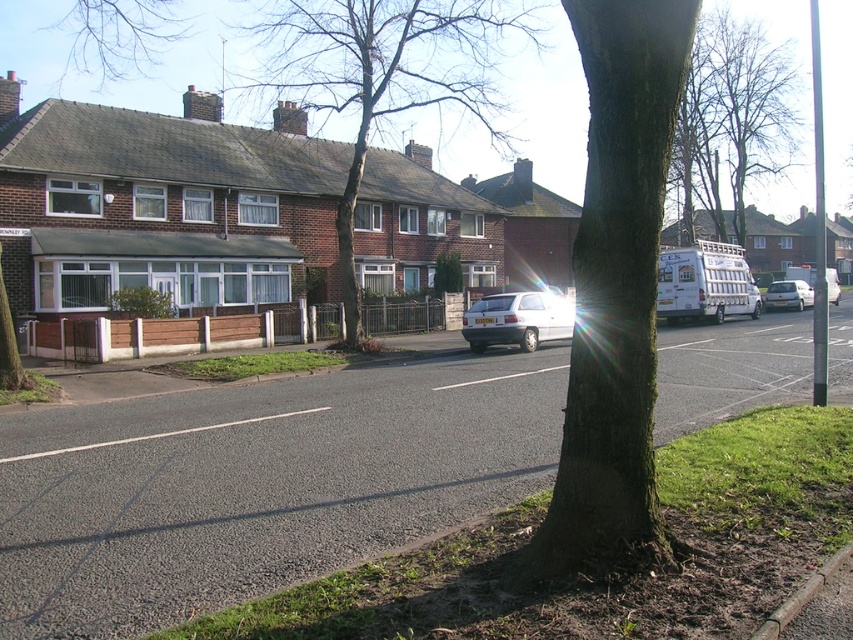
You are a delivery driver trying to park your white matte van at center in a spot that can accommodate its size. The parking spot you want is currently occupied by the white matte van at right. Based on the scene, can you estimate if your van will fit in the spot once the other van leaves?

The white matte van at center is smaller than the white matte van at right. Since your van is smaller, it should fit in the parking spot currently occupied by the larger van at right.